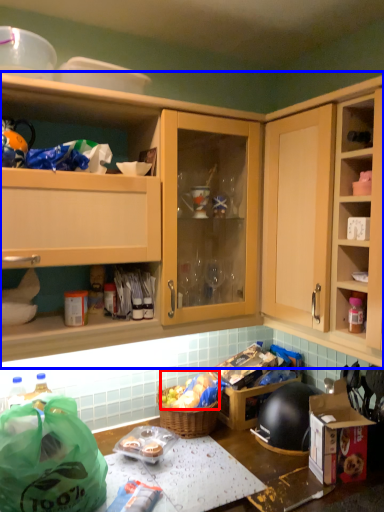
Question: Which object appears farthest to the camera in this image, stuff (highlighted by a red box) or cabinetry (highlighted by a blue box)?

Choices:
 (A) stuff
 (B) cabinetry

Answer: (A)